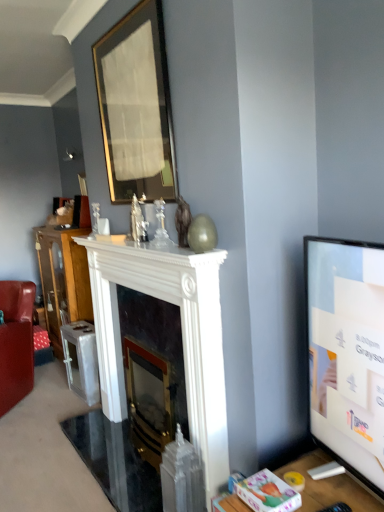
Question: Does gold-framed mirror at upper center turn towards flat screen tv at right?

Choices:
 (A) yes
 (B) no

Answer: (B)

Question: Are gold-framed mirror at upper center and flat screen tv at right far apart?

Choices:
 (A) yes
 (B) no

Answer: (A)

Question: Is flat screen tv at right a part of gold-framed mirror at upper center?

Choices:
 (A) yes
 (B) no

Answer: (B)

Question: Does gold-framed mirror at upper center have a lesser width compared to flat screen tv at right?

Choices:
 (A) no
 (B) yes

Answer: (B)

Question: Considering the relative sizes of gold-framed mirror at upper center and flat screen tv at right in the image provided, is gold-framed mirror at upper center shorter than flat screen tv at right?

Choices:
 (A) yes
 (B) no

Answer: (B)

Question: Considering the relative positions of wooden cabinet at left and white glossy fireplace at center, which appears as the 2th fireplace when viewed from the back, in the image provided, is wooden cabinet at left to the left or to the right of white glossy fireplace at center, which appears as the 2th fireplace when viewed from the back,?

Choices:
 (A) left
 (B) right

Answer: (A)

Question: From the image's perspective, is wooden cabinet at left positioned above or below white glossy fireplace at center, which appears as the 2th fireplace when viewed from the back?

Choices:
 (A) below
 (B) above

Answer: (B)

Question: In the image, is wooden cabinet at left positioned in front of or behind white glossy fireplace at center, which appears as the 2th fireplace when viewed from the back?

Choices:
 (A) behind
 (B) front

Answer: (A)

Question: Is wooden cabinet at left bigger or smaller than white glossy fireplace at center, the 1th fireplace in the front-to-back sequence?

Choices:
 (A) small
 (B) big

Answer: (B)

Question: From the image's perspective, is white glossy fireplace at center, the 1th fireplace in the front-to-back sequence, positioned above or below polished brass fireplace at center, the second fireplace when ordered from front to back?

Choices:
 (A) above
 (B) below

Answer: (A)

Question: From a real-world perspective, is white glossy fireplace at center, which appears as the 2th fireplace when viewed from the back, above or below polished brass fireplace at center, which ranks as the first fireplace in back-to-front order?

Choices:
 (A) above
 (B) below

Answer: (A)

Question: Is point (213, 303) closer or farther from the camera than point (144, 371)?

Choices:
 (A) closer
 (B) farther

Answer: (A)

Question: Considering the positions of white glossy fireplace at center, the 1th fireplace in the front-to-back sequence, and polished brass fireplace at center, the second fireplace when ordered from front to back, in the image, is white glossy fireplace at center, the 1th fireplace in the front-to-back sequence, wider or thinner than polished brass fireplace at center, the second fireplace when ordered from front to back,?

Choices:
 (A) wide
 (B) thin

Answer: (A)

Question: From the image's perspective, relative to wooden cabinet at left, is white glossy fireplace at center, the 1th fireplace in the front-to-back sequence, above or below?

Choices:
 (A) below
 (B) above

Answer: (A)

Question: In the image, is white glossy fireplace at center, the 1th fireplace in the front-to-back sequence, on the left side or the right side of wooden cabinet at left?

Choices:
 (A) left
 (B) right

Answer: (B)